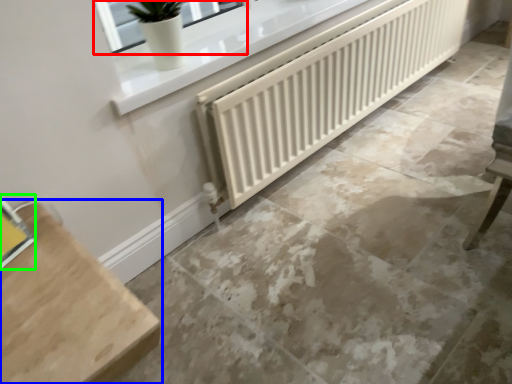
Question: Which object is the farthest from window (highlighted by a red box)? Choose among these: furniture (highlighted by a blue box) or window (highlighted by a green box).

Choices:
 (A) furniture
 (B) window

Answer: (A)